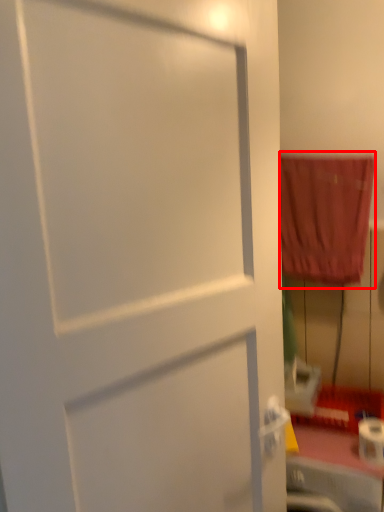
Question: From the image, what is the correct spatial relationship of curtain (annotated by the red box) in relation to toilet paper?

Choices:
 (A) left
 (B) right

Answer: (A)